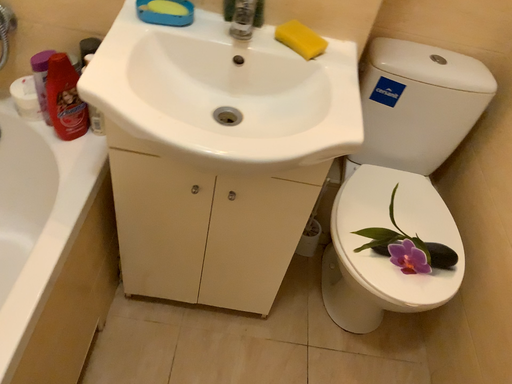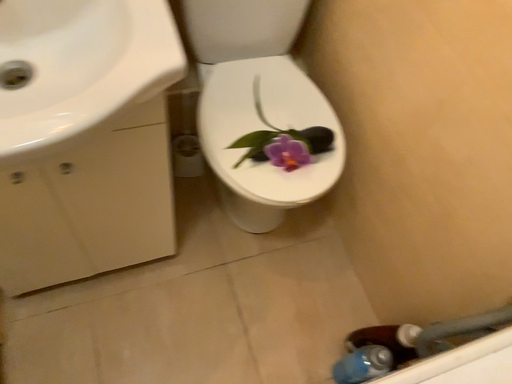
Question: Which way did the camera rotate in the video?

Choices:
 (A) rotated upward
 (B) rotated downward

Answer: (B)